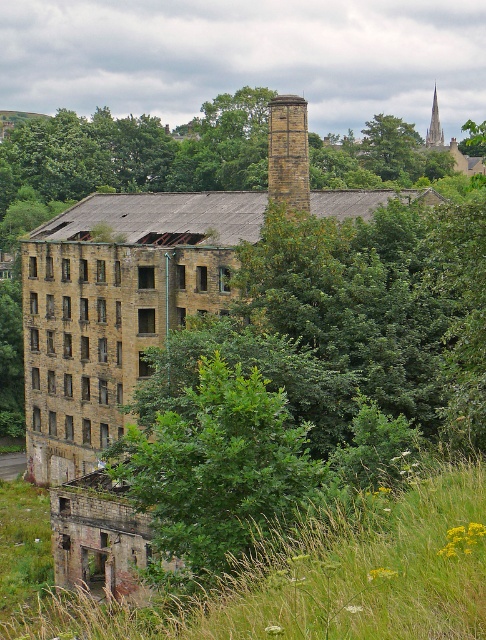
Can you confirm if brown brick chimney at center is taller than smooth stone spire at upper right?

In fact, brown brick chimney at center may be shorter than smooth stone spire at upper right.

Can you confirm if brown brick chimney at center is positioned below smooth stone spire at upper right?

Indeed, brown brick chimney at center is positioned under smooth stone spire at upper right.

Locate an element on the screen. This screenshot has height=640, width=486. brown brick chimney at center is located at coordinates (289, 152).

This screenshot has width=486, height=640. What are the coordinates of `brown brick chimney at center` in the screenshot? It's located at (289, 152).

The width and height of the screenshot is (486, 640). What do you see at coordinates (473, 138) in the screenshot?
I see `green leafy tree at center` at bounding box center [473, 138].

Can you confirm if green leafy tree at center is positioned to the right of smooth stone spire at upper right?

Indeed, green leafy tree at center is positioned on the right side of smooth stone spire at upper right.

Which is in front, point (468, 147) or point (433, 129)?

Point (468, 147) is more forward.

Image resolution: width=486 pixels, height=640 pixels. What are the coordinates of `green leafy tree at center` in the screenshot? It's located at (473, 138).

This screenshot has height=640, width=486. What are the coordinates of `brown brick chimney at center` in the screenshot? It's located at (289, 152).

Which is more to the right, brown brick chimney at center or green leafy tree at center?

From the viewer's perspective, green leafy tree at center appears more on the right side.

Identify the location of brown brick chimney at center. (289, 152).